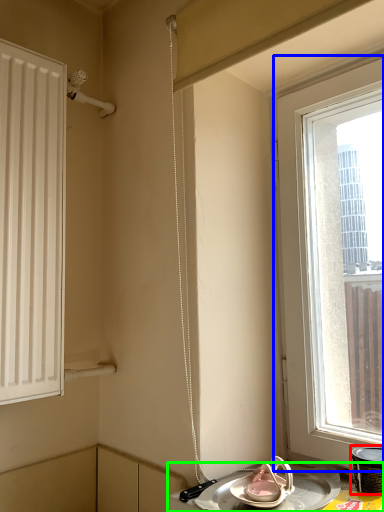
Question: Which object is positioned closest to appliance (highlighted by a red box)? Select from window (highlighted by a blue box) and table (highlighted by a green box).

Choices:
 (A) window
 (B) table

Answer: (B)